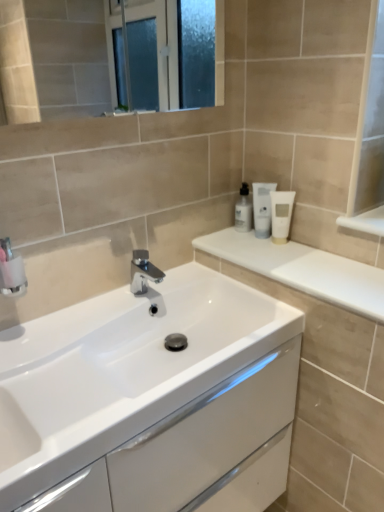
At what (x,y) coordinates should I click in order to perform the action: click on vacant area that is situated to the right of chrome metallic faucet at center. Please return your answer as a coordinate pair (x, y). Image resolution: width=384 pixels, height=512 pixels. Looking at the image, I should click on (198, 287).